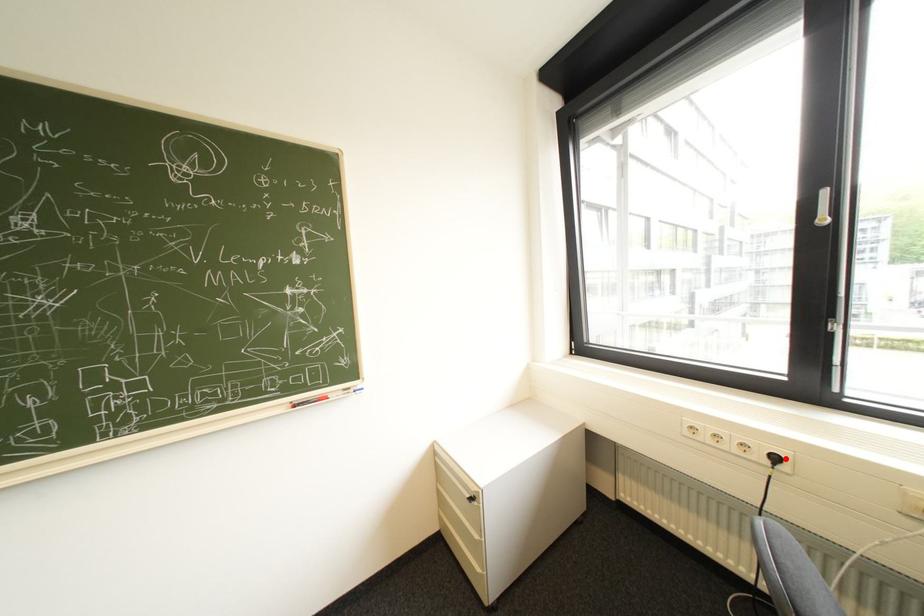
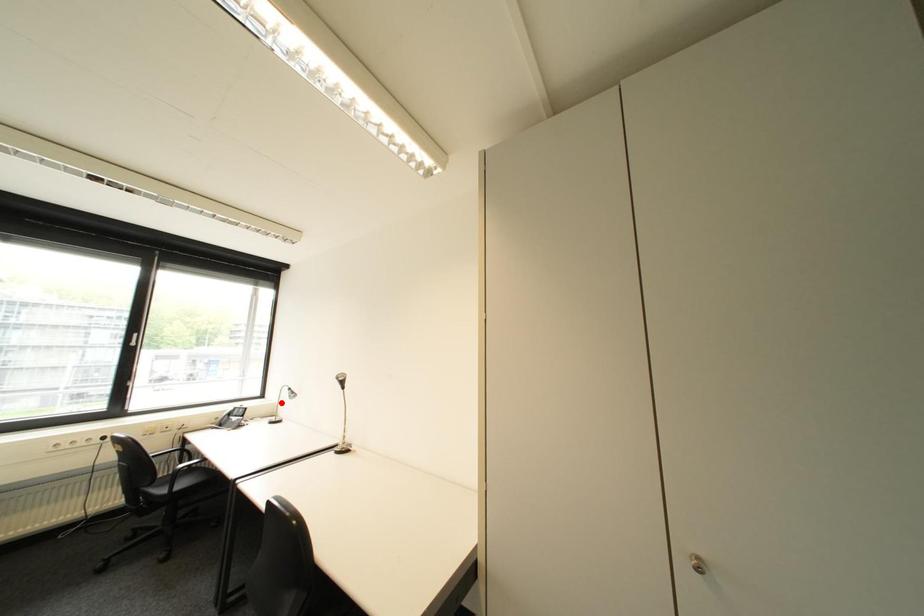
I am providing you with two images of the same scene from different viewpoints. A red point is marked on the first image and another point is marked on the second image. Are the points marked in image1 and image2 representing the same 3D position?

No